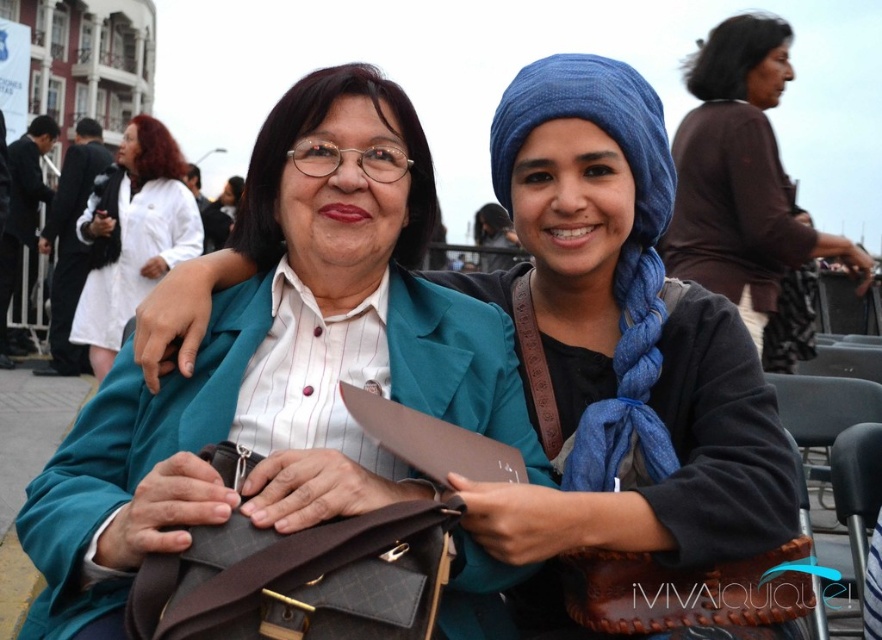
You are a photographer at this event and want to ensure both the brown matte shirt at upper right and the white smooth coat at upper left are visible in your photo. Which one should you focus on to capture both without cropping either?

The brown matte shirt at upper right is taller than the white smooth coat at upper left, so you should focus on the brown matte shirt at upper right to ensure both are fully visible in the photo.

You are at an event and need to place both the brown leather bag at center and the blue fabric headscarf at center into a storage bin. The bin has a width of 30 cm. Based on their sizes, can both items fit side by side in the bin?

The brown leather bag at center might be wider than blue fabric headscarf at center, so it is uncertain if both can fit side by side in a 30 cm wide bin. Check the exact width of the bag first.

You are a photographer at the event and want to capture a clear shot of both the brown leather bag at center and the blue fabric headscarf at center. Which object is closer to the camera based on their positions?

The blue fabric headscarf at center is closer to the camera because the brown leather bag at center is positioned under it.